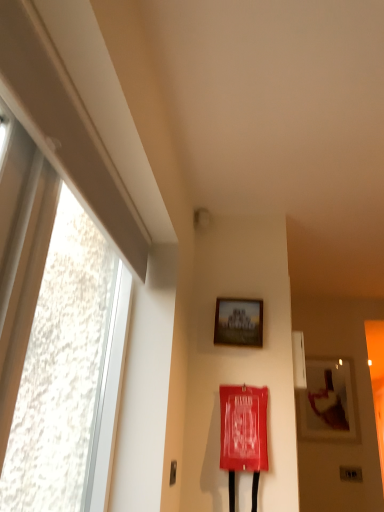
Question: Is metallic silver door handle at lower left taller than wooden picture frame at upper right, which is counted as the 2th picture frame, starting from the left?

Choices:
 (A) no
 (B) yes

Answer: (A)

Question: Does metallic silver door handle at lower left appear on the right side of wooden picture frame at upper right, placed as the 1th picture frame when sorted from bottom to top?

Choices:
 (A) yes
 (B) no

Answer: (B)

Question: Does metallic silver door handle at lower left have a smaller size compared to wooden picture frame at upper right, which is counted as the 2th picture frame, starting from the left?

Choices:
 (A) no
 (B) yes

Answer: (B)

Question: Is metallic silver door handle at lower left oriented away from wooden picture frame at upper right, which appears as the second picture frame when viewed from the top?

Choices:
 (A) no
 (B) yes

Answer: (A)

Question: Is metallic silver door handle at lower left outside of wooden picture frame at upper right, which is the 2th picture frame from front to back?

Choices:
 (A) no
 (B) yes

Answer: (B)

Question: From the image's perspective, relative to wooden picture frame at upper right, which is counted as the 2th picture frame, starting from the left, is matte wooden picture frame at upper center, which is the 2th picture frame in back-to-front order, above or below?

Choices:
 (A) above
 (B) below

Answer: (A)

Question: Is matte wooden picture frame at upper center, the first picture frame when ordered from left to right, wider or thinner than wooden picture frame at upper right, which appears as the second picture frame when viewed from the top?

Choices:
 (A) thin
 (B) wide

Answer: (B)

Question: Is matte wooden picture frame at upper center, which is counted as the second picture frame, starting from the bottom, in front of or behind wooden picture frame at upper right, which is the 2th picture frame from front to back, in the image?

Choices:
 (A) front
 (B) behind

Answer: (A)

Question: Based on their positions, is matte wooden picture frame at upper center, the first picture frame from the top, located to the left or right of wooden picture frame at upper right, acting as the first picture frame starting from the back?

Choices:
 (A) left
 (B) right

Answer: (A)

Question: Considering the positions of point (236, 331) and point (69, 289), is point (236, 331) closer or farther from the camera than point (69, 289)?

Choices:
 (A) closer
 (B) farther

Answer: (B)

Question: Considering their positions, is matte wooden picture frame at upper center, the first picture frame when ordered from left to right, located in front of or behind transparent glass window at left?

Choices:
 (A) behind
 (B) front

Answer: (A)

Question: From the image's perspective, is matte wooden picture frame at upper center, which is the 2th picture frame in back-to-front order, positioned above or below transparent glass window at left?

Choices:
 (A) below
 (B) above

Answer: (A)

Question: Based on their sizes in the image, would you say matte wooden picture frame at upper center, which is the 2th picture frame in back-to-front order, is bigger or smaller than transparent glass window at left?

Choices:
 (A) small
 (B) big

Answer: (A)

Question: From the image's perspective, is wooden picture frame at upper right, which appears as the second picture frame when viewed from the top, positioned above or below metallic silver door handle at lower left?

Choices:
 (A) above
 (B) below

Answer: (B)

Question: Is point (311, 411) positioned closer to the camera than point (170, 476)?

Choices:
 (A) farther
 (B) closer

Answer: (A)